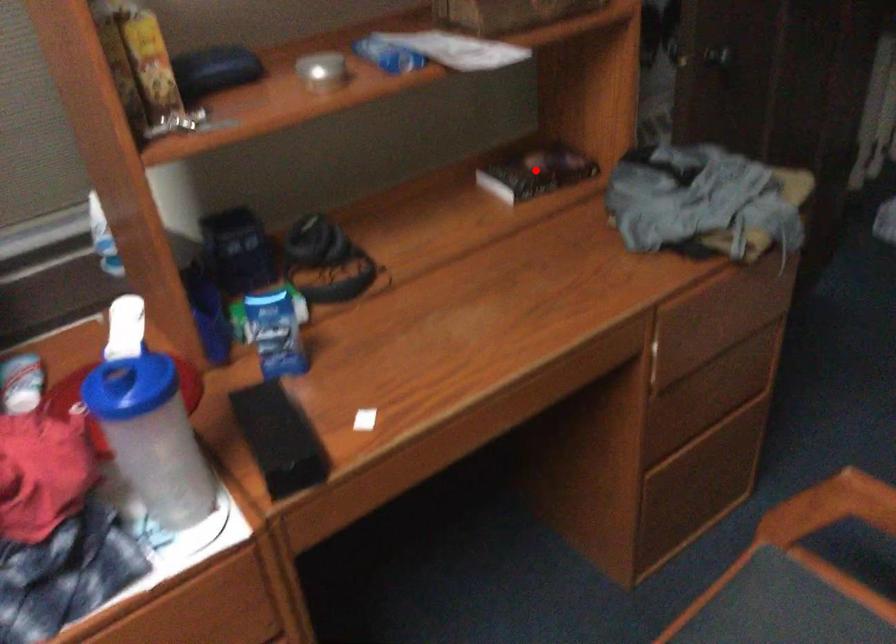
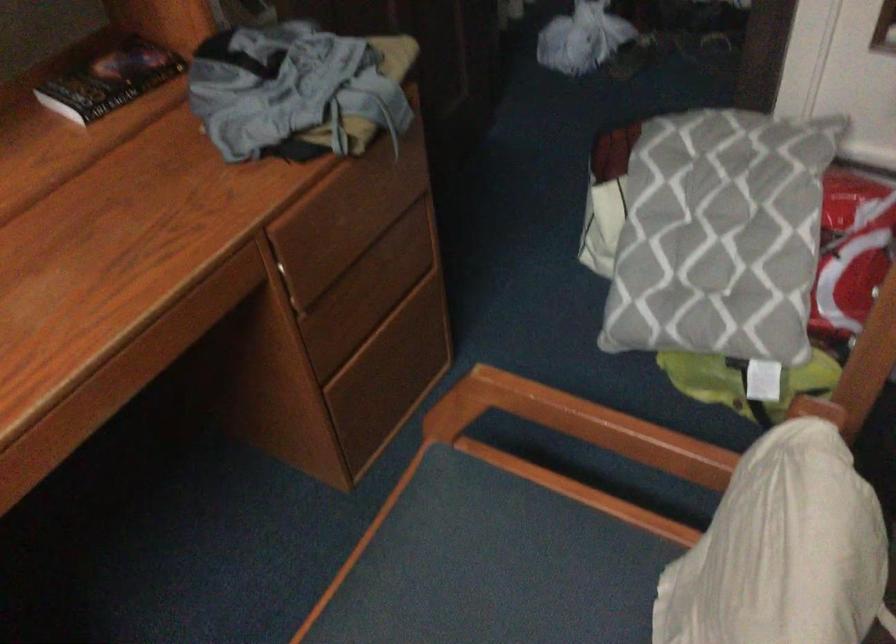
In the second image, find the point that corresponds to the highlighted location in the first image.

(110, 80)